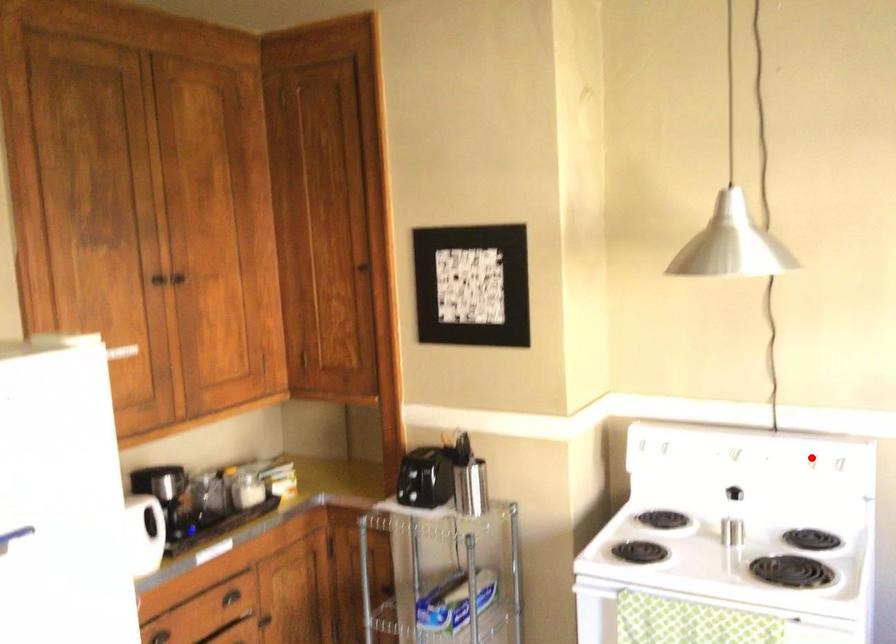
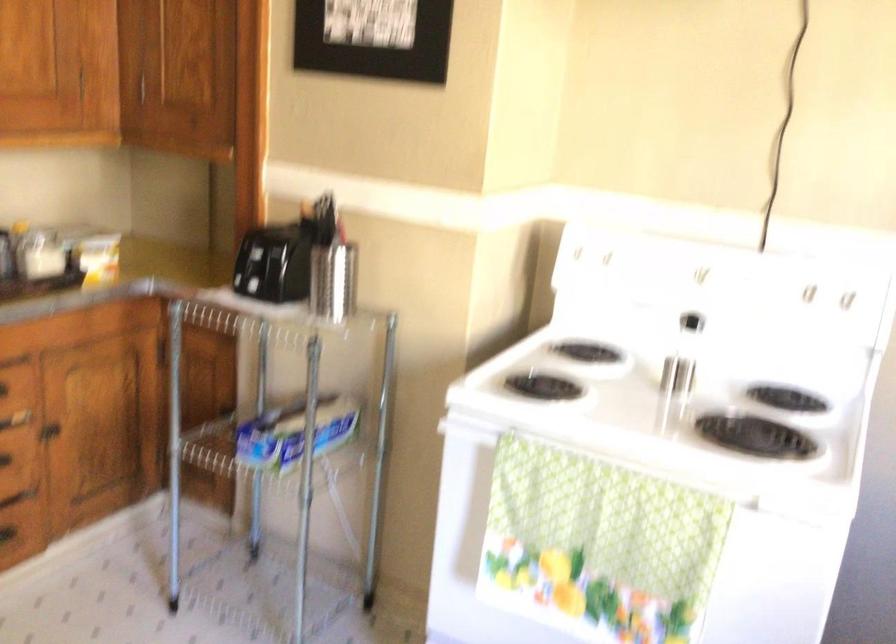
Question: I am providing you with two images of the same scene from different viewpoints. A red point is shown in image1. For the corresponding object point in image2, is it positioned nearer or farther from the camera?

Choices:
 (A) Nearer
 (B) Farther

Answer: (A)